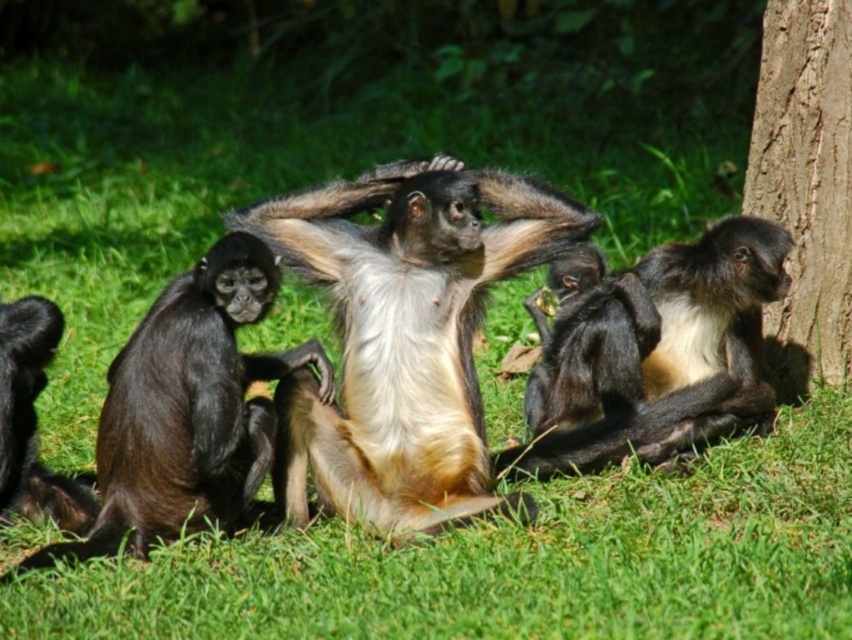
Who is more distant from viewer, (446, 244) or (27, 442)?

The point (27, 442) is more distant.

Is shiny fur monkey at center below black silky fur monkey at lower left?

Actually, shiny fur monkey at center is above black silky fur monkey at lower left.

Between point (444, 291) and point (27, 337), which one is positioned behind?

Point (27, 337)

Identify the location of shiny fur monkey at center. The height and width of the screenshot is (640, 852). (403, 336).

Does point (734, 228) come farther from viewer compared to point (229, 276)?

Yes, it is behind point (229, 276).

Identify the location of black silky monkey at right. (655, 355).

Is point (387, 484) positioned in front of point (563, 412)?

Yes, point (387, 484) is closer to viewer.

Describe the element at coordinates (403, 336) in the screenshot. I see `shiny fur monkey at center` at that location.

Measure the distance between shiny fur monkey at center and camera.

shiny fur monkey at center and camera are 4.13 meters apart from each other.

You are a GUI agent. You are given a task and a screenshot of the screen. Output one action in this format:
    pyautogui.click(x=<x>, y=<y>)
    Task: Click on the shiny fur monkey at center
    
    Given the screenshot: What is the action you would take?
    pyautogui.click(x=403, y=336)